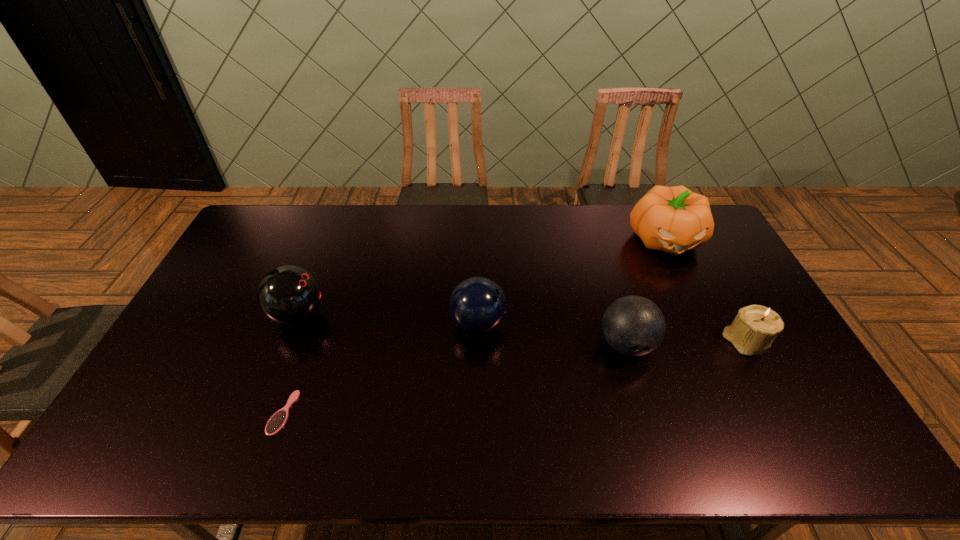
Where is `vacant region at the left edge of the desktop`? This screenshot has width=960, height=540. vacant region at the left edge of the desktop is located at coordinates (187, 349).

I want to click on vacant space in between the leftmost bowling ball and the farthest object, so click(x=482, y=277).

The image size is (960, 540). Find the location of `free point between the third object from right to left and the farthest object`. free point between the third object from right to left and the farthest object is located at coordinates (646, 292).

At what (x,y) coordinates should I click in order to perform the action: click on free space between the leftmost bowling ball and the hairbrush. Please return your answer as a coordinate pair (x, y). Looking at the image, I should click on (291, 364).

You are a GUI agent. You are given a task and a screenshot of the screen. Output one action in this format:
    pyautogui.click(x=<x>, y=<y>)
    Task: Click on the free space between the hairbrush and the fourth object from left to right
    Image resolution: width=960 pixels, height=540 pixels.
    Given the screenshot: What is the action you would take?
    pyautogui.click(x=455, y=379)

Locate an element on the screen. free space between the hairbrush and the rightmost bowling ball is located at coordinates (455, 379).

Locate an element on the screen. free space between the third object from right to left and the second bowling ball from left to right is located at coordinates (552, 334).

Locate an element on the screen. The width and height of the screenshot is (960, 540). empty location between the leftmost bowling ball and the second bowling ball from left to right is located at coordinates (388, 319).

Identify the location of vacant region between the second bowling ball from right to left and the leftmost bowling ball. This screenshot has height=540, width=960. (388, 319).

I want to click on object that is the closest to the third object from right to left, so click(x=755, y=327).